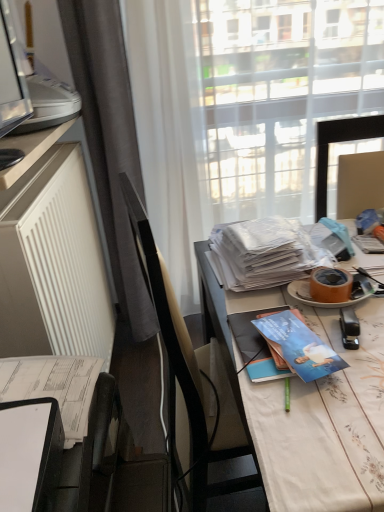
The image size is (384, 512). What are the coordinates of `empty space that is ontop of orange matte plate at right (from a real-world perspective)` in the screenshot? It's located at [335, 281].